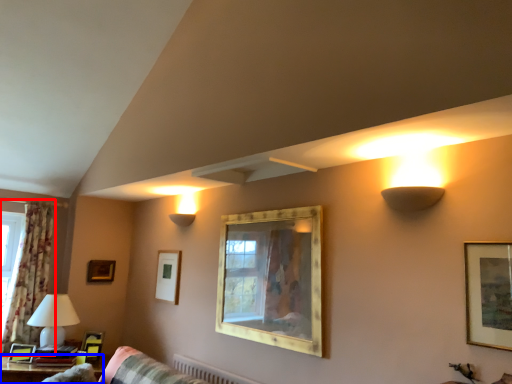
Question: Which of the following is the closest to the observer, window (highlighted by a red box) or table (highlighted by a blue box)?

Choices:
 (A) window
 (B) table

Answer: (B)